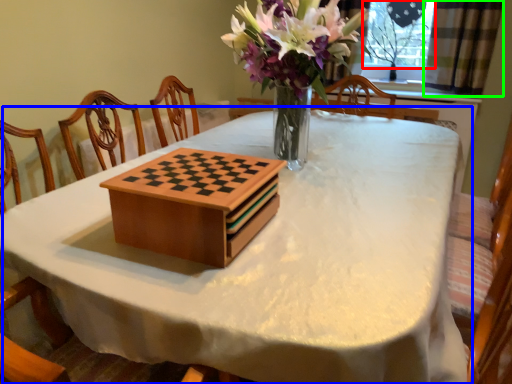
Question: Which object is the closest to the window screen (highlighted by a red box)? Choose among these: table (highlighted by a blue box) or curtain (highlighted by a green box).

Choices:
 (A) table
 (B) curtain

Answer: (B)